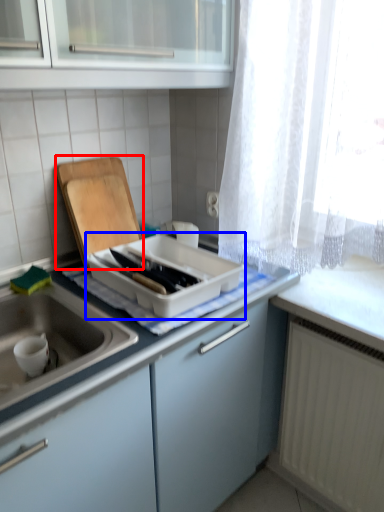
Question: Which point is further to the camera, cutting board (highlighted by a red box) or kitchen appliance (highlighted by a blue box)?

Choices:
 (A) cutting board
 (B) kitchen appliance

Answer: (A)